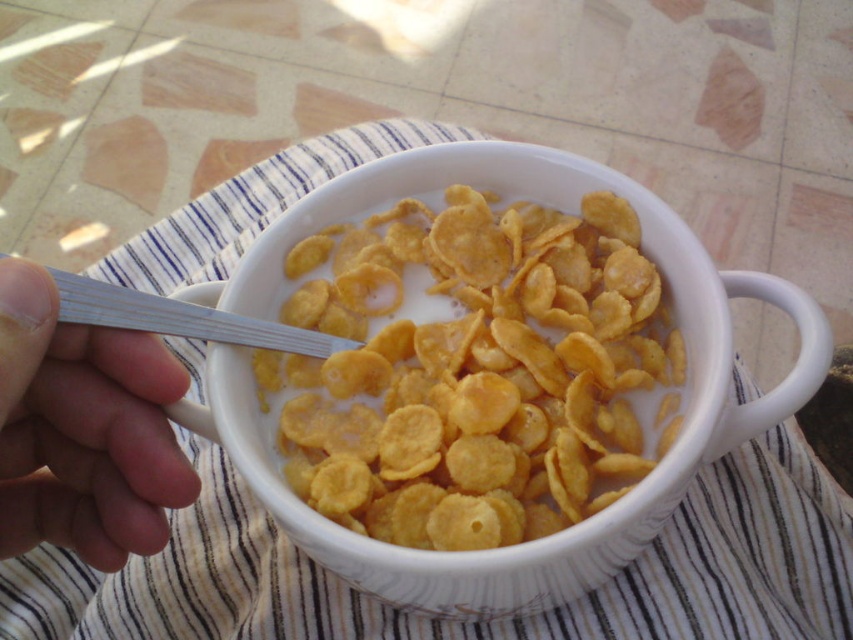
You are taking a photo of the bowl of cereal with your phone. The white plastic spoon at upper left is in the frame. If your phone is 12 inches away from the spoon, will the spoon be in focus if your camera has a depth of field that can only focus on objects within 1 inch of the main subject?

The white plastic spoon at upper left and camera are 11.94 inches apart from each other. Since the camera needs to focus within 1 inch of the main subject, and the spoon is only 11.94 inches away, which is outside the 1 inch range, the spoon will not be in focus.